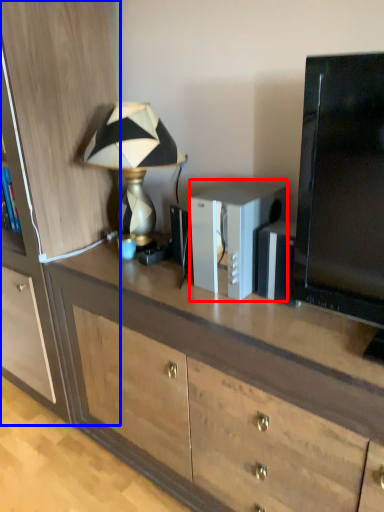
Question: Which of the following is the closest to the observer, appliance (highlighted by a red box) or cabinetry (highlighted by a blue box)?

Choices:
 (A) appliance
 (B) cabinetry

Answer: (A)